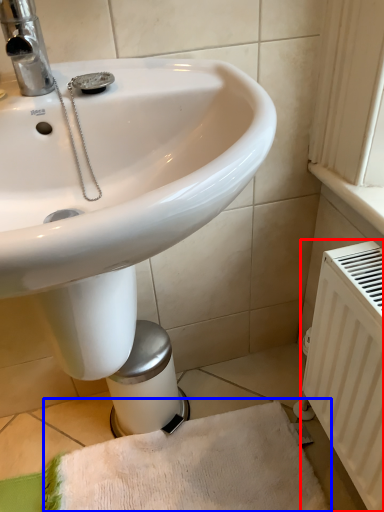
Question: Among these objects, which one is farthest to the camera, radiator (highlighted by a red box) or bath towel (highlighted by a blue box)?

Choices:
 (A) radiator
 (B) bath towel

Answer: (B)